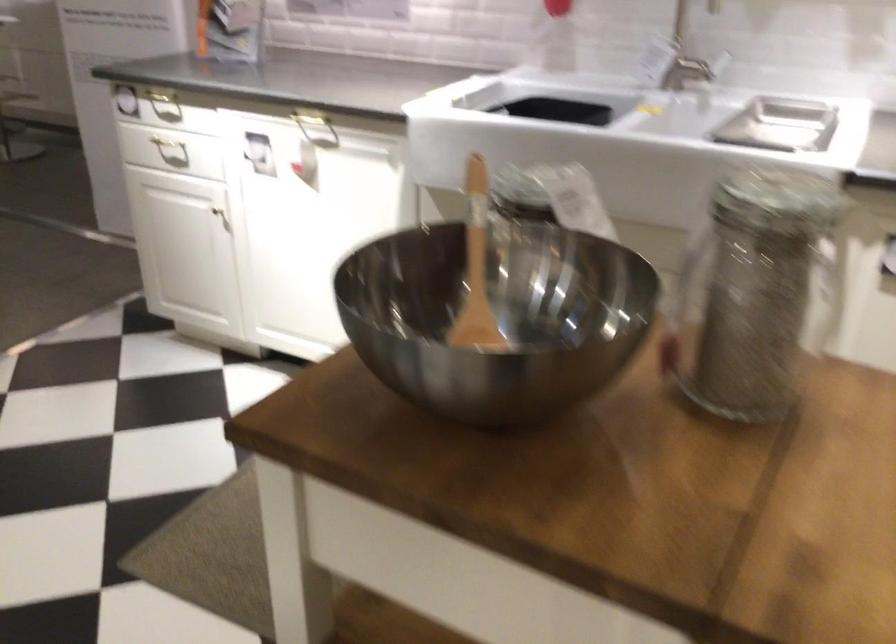
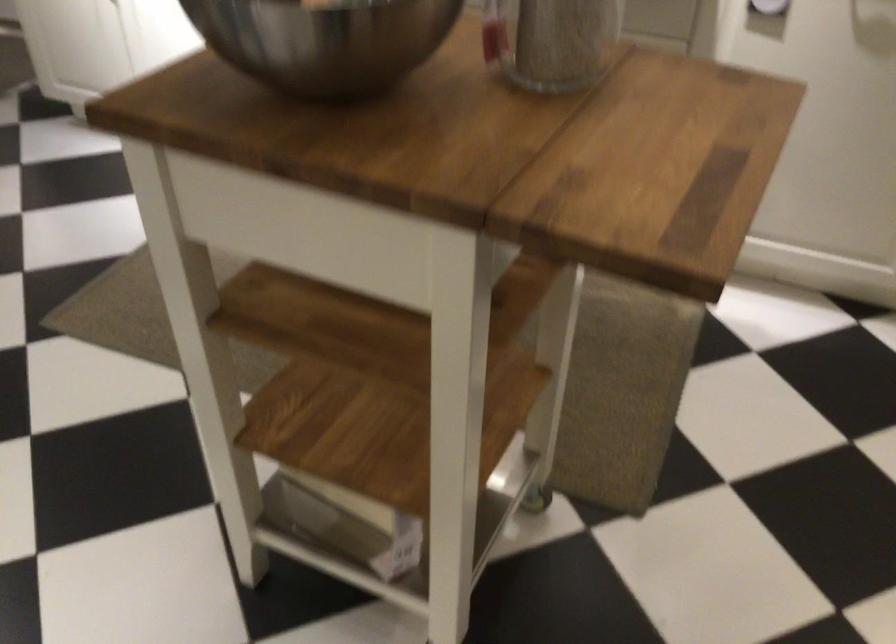
Find the pixel in the second image that matches point (738, 366) in the first image.

(553, 41)